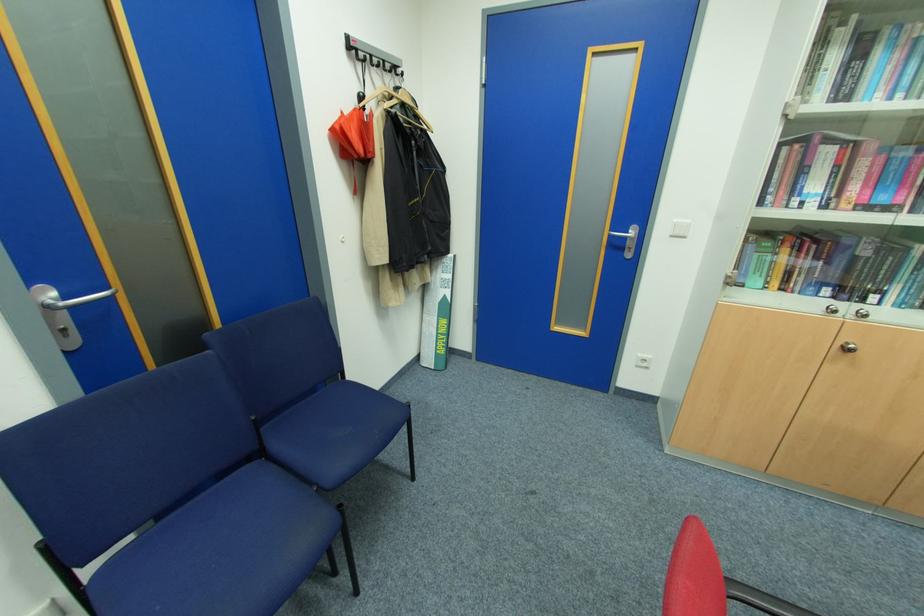
You are a GUI agent. You are given a task and a screenshot of the screen. Output one action in this format:
    pyautogui.click(x=<x>, y=<y>)
    Task: Click on the white light switch
    
    Given the screenshot: What is the action you would take?
    pyautogui.click(x=679, y=228)